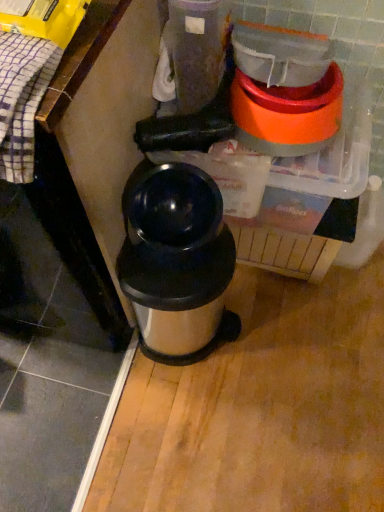
What do you see at coordinates (284, 90) in the screenshot? The height and width of the screenshot is (512, 384). I see `orange plastic blender at upper right` at bounding box center [284, 90].

Where is `orange plastic blender at upper right`? This screenshot has height=512, width=384. orange plastic blender at upper right is located at coordinates (284, 90).

The width and height of the screenshot is (384, 512). What do you see at coordinates (177, 263) in the screenshot?
I see `stainless steel thermos at center` at bounding box center [177, 263].

I want to click on stainless steel thermos at center, so click(x=177, y=263).

Find the location of `orange plastic blender at upper right`. orange plastic blender at upper right is located at coordinates (284, 90).

In the image, is orange plastic blender at upper right on the left side or the right side of stainless steel thermos at center?

orange plastic blender at upper right is to the right of stainless steel thermos at center.

Considering the relative positions of orange plastic blender at upper right and stainless steel thermos at center in the image provided, is orange plastic blender at upper right in front of stainless steel thermos at center?

Yes, the depth of orange plastic blender at upper right is less than that of stainless steel thermos at center.

Considering the points (258, 41) and (175, 359), which point is in front, point (258, 41) or point (175, 359)?

Point (258, 41)

From the image's perspective, who appears lower, orange plastic blender at upper right or stainless steel thermos at center?

stainless steel thermos at center.

Based on the photo, from a real-world perspective, between orange plastic blender at upper right and stainless steel thermos at center, who is vertically lower?

From a 3D spatial view, stainless steel thermos at center is below.

Between orange plastic blender at upper right and stainless steel thermos at center, which one has larger width?

With larger width is orange plastic blender at upper right.

Based on the photo, does orange plastic blender at upper right have a greater height compared to stainless steel thermos at center?

No.

Considering the sizes of objects orange plastic blender at upper right and stainless steel thermos at center in the image provided, who is smaller, orange plastic blender at upper right or stainless steel thermos at center?

Smaller between the two is orange plastic blender at upper right.

Is orange plastic blender at upper right inside or outside of stainless steel thermos at center?

orange plastic blender at upper right is not inside stainless steel thermos at center, it's outside.

Does orange plastic blender at upper right touch stainless steel thermos at center?

No, orange plastic blender at upper right is not making contact with stainless steel thermos at center.

Is orange plastic blender at upper right facing away from stainless steel thermos at center?

No, stainless steel thermos at center is not at the back of orange plastic blender at upper right.

At what (x,y) coordinates should I click in order to perform the action: click on waste container on the left of orange plastic blender at upper right. Please return your answer as a coordinate pair (x, y). This screenshot has height=512, width=384. Looking at the image, I should click on (177, 263).

In the image, is stainless steel thermos at center on the left side or the right side of orange plastic blender at upper right?

Based on their positions, stainless steel thermos at center is located to the left of orange plastic blender at upper right.

Does stainless steel thermos at center lie in front of orange plastic blender at upper right?

No, stainless steel thermos at center is further to the viewer.

Does point (137, 301) appear closer or farther from the camera than point (283, 103)?

Point (137, 301).

From the image's perspective, between stainless steel thermos at center and orange plastic blender at upper right, which one is located above?

From the image's view, orange plastic blender at upper right is above.

From a real-world perspective, is stainless steel thermos at center under orange plastic blender at upper right?

Indeed, from a real-world perspective, stainless steel thermos at center is positioned beneath orange plastic blender at upper right.

Between stainless steel thermos at center and orange plastic blender at upper right, which one has larger width?

orange plastic blender at upper right is wider.

Considering the sizes of stainless steel thermos at center and orange plastic blender at upper right in the image, is stainless steel thermos at center taller or shorter than orange plastic blender at upper right?

In the image, stainless steel thermos at center appears to be taller than orange plastic blender at upper right.

Can you confirm if stainless steel thermos at center is smaller than orange plastic blender at upper right?

Incorrect, stainless steel thermos at center is not smaller in size than orange plastic blender at upper right.

Is orange plastic blender at upper right located within stainless steel thermos at center?

No, orange plastic blender at upper right is not a part of stainless steel thermos at center.

Is stainless steel thermos at center next to orange plastic blender at upper right?

No.

Is stainless steel thermos at center turned away from orange plastic blender at upper right?

No, orange plastic blender at upper right is not at the back of stainless steel thermos at center.

How many degrees apart are the facing directions of stainless steel thermos at center and orange plastic blender at upper right?

They differ by 0.000187 degrees in their facing directions.

The width and height of the screenshot is (384, 512). I want to click on blender in front of the stainless steel thermos at center, so click(x=284, y=90).

Where is `waste container on the left of orange plastic blender at upper right`? Image resolution: width=384 pixels, height=512 pixels. waste container on the left of orange plastic blender at upper right is located at coordinates [x=177, y=263].

The image size is (384, 512). Find the location of `blender that is above the stainless steel thermos at center (from the image's perspective)`. blender that is above the stainless steel thermos at center (from the image's perspective) is located at coordinates (284, 90).